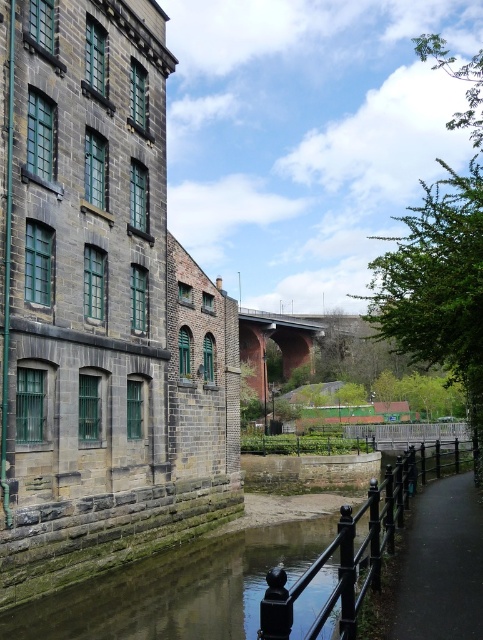
Question: Is green mossy stone river at lower left below brick arch bridge at center?

Choices:
 (A) yes
 (B) no

Answer: (A)

Question: Does green mossy stone river at lower left have a greater width compared to black metal/rail at lower center?

Choices:
 (A) yes
 (B) no

Answer: (B)

Question: Among these points, which one is nearest to the camera?

Choices:
 (A) (283, 353)
 (B) (454, 440)

Answer: (B)

Question: Which point is farther to the camera?

Choices:
 (A) green mossy stone river at lower left
 (B) black asphalt path at lower right
 (C) brick arch bridge at center

Answer: (C)

Question: Which object is positioned closest to the brick arch bridge at center?

Choices:
 (A) green mossy stone river at lower left
 (B) black asphalt path at lower right

Answer: (A)

Question: Does black asphalt path at lower right come behind brick arch bridge at center?

Choices:
 (A) no
 (B) yes

Answer: (A)